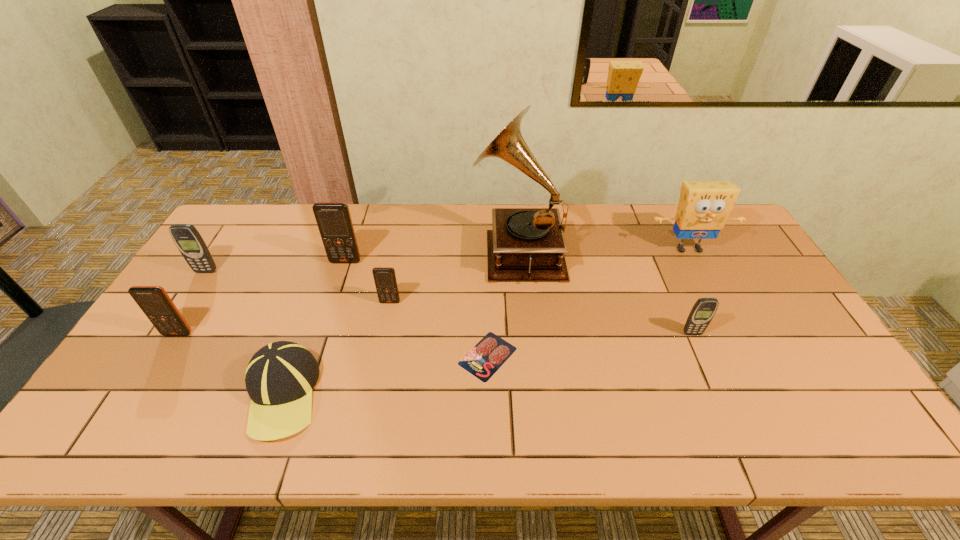
Locate an element on the screen. The image size is (960, 540). the smallest orange cellular telephone is located at coordinates (385, 280).

At what (x,y) coordinates should I click in order to perform the action: click on the right gray cellular telephone. Please return your answer as a coordinate pair (x, y). This screenshot has height=540, width=960. Looking at the image, I should click on pos(704,309).

Where is `the rightmost cellular telephone`? This screenshot has width=960, height=540. the rightmost cellular telephone is located at coordinates (704, 309).

The height and width of the screenshot is (540, 960). Find the location of `black baseball cap`. black baseball cap is located at coordinates (279, 379).

Locate an element on the screen. the eighth tallest object is located at coordinates (279, 379).

Image resolution: width=960 pixels, height=540 pixels. In order to click on salami in this screenshot , I will do `click(491, 352)`.

Identify the location of vacant region located on the horn of the brown record player. (355, 251).

At what (x,y) coordinates should I click in order to perform the action: click on blank space located 0.270m on the horn of the brown record player. Please return your answer as a coordinate pair (x, y). Looking at the image, I should click on (392, 251).

Find the location of a particular element. vacant space located 0.160m on the horn of the brown record player is located at coordinates (424, 251).

The width and height of the screenshot is (960, 540). I want to click on free space located 0.400m on the face of the sponge, so click(x=750, y=365).